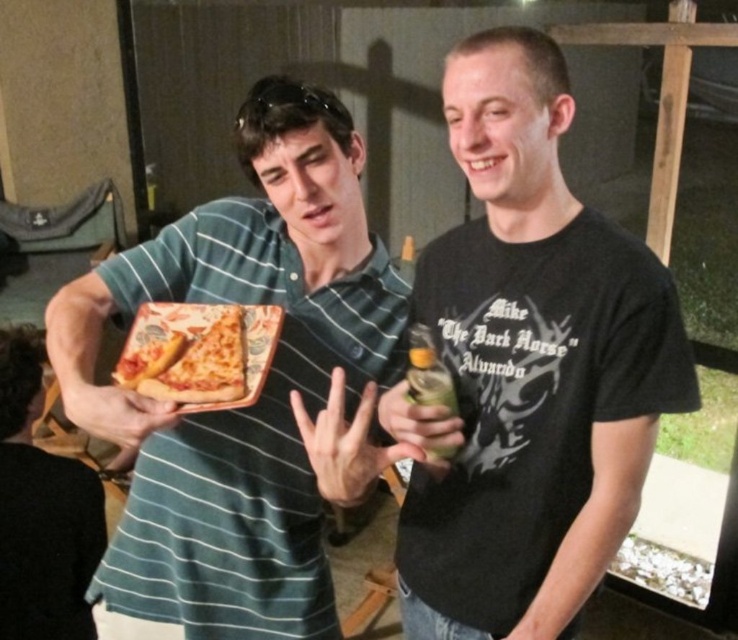
From the picture: Which is more to the right, black matte t-shirt at center or green striped polo shirt at left?

Positioned to the right is black matte t-shirt at center.

What do you see at coordinates (528, 369) in the screenshot? I see `black matte t-shirt at center` at bounding box center [528, 369].

Image resolution: width=738 pixels, height=640 pixels. What do you see at coordinates (528, 369) in the screenshot? I see `black matte t-shirt at center` at bounding box center [528, 369].

Locate an element on the screen. The height and width of the screenshot is (640, 738). black matte t-shirt at center is located at coordinates (528, 369).

Can you confirm if black matte t-shirt at center is thinner than matte ceramic platter at center?

No, black matte t-shirt at center is not thinner than matte ceramic platter at center.

Which is above, black matte t-shirt at center or matte ceramic platter at center?

Positioned higher is matte ceramic platter at center.

Identify the location of black matte t-shirt at center. (528, 369).

In order to click on black matte t-shirt at center in this screenshot , I will do `click(528, 369)`.

Which is below, green striped polo shirt at left or matte ceramic platter at center?

Positioned lower is green striped polo shirt at left.

Can you confirm if green striped polo shirt at left is smaller than matte ceramic platter at center?

Incorrect, green striped polo shirt at left is not smaller in size than matte ceramic platter at center.

Locate an element on the screen. This screenshot has width=738, height=640. green striped polo shirt at left is located at coordinates click(x=262, y=390).